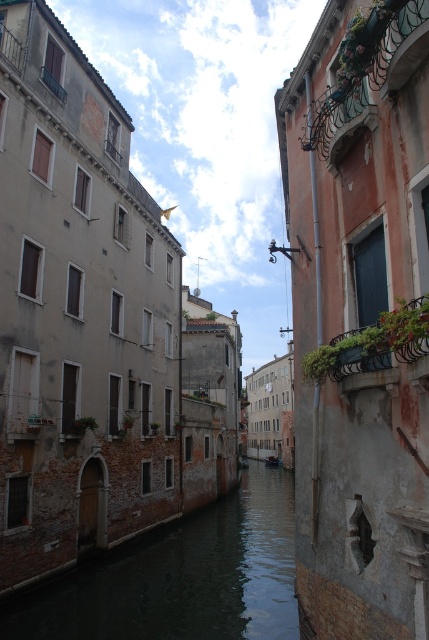
You are a tourist standing on the right side of the canal and want to take a photo of the wooden boat at center and the dark water at center. Which object will appear taller in your photo?

The dark water at center will appear taller in your photo because it has a greater height compared to the wooden boat at center.

You are a tour guide leading a group along the canal. You want to ensure your group can hear you clearly. Considering the distance between the dark water at center and the wooden boat at center, would your voice carry well over the canal?

The distance between the dark water at center and the wooden boat at center is 70.24 meters. Since sound can travel over water with minimal obstruction, your voice might carry well, but at such a distance, it may still be difficult for the group to hear clearly without amplification.

You are a tourist standing on the right side of the canal. You see the dark water at center and the wooden boat at center. Which object is closer to your right side?

The wooden boat at center is closer to your right side because it is to the right of the dark water at center.